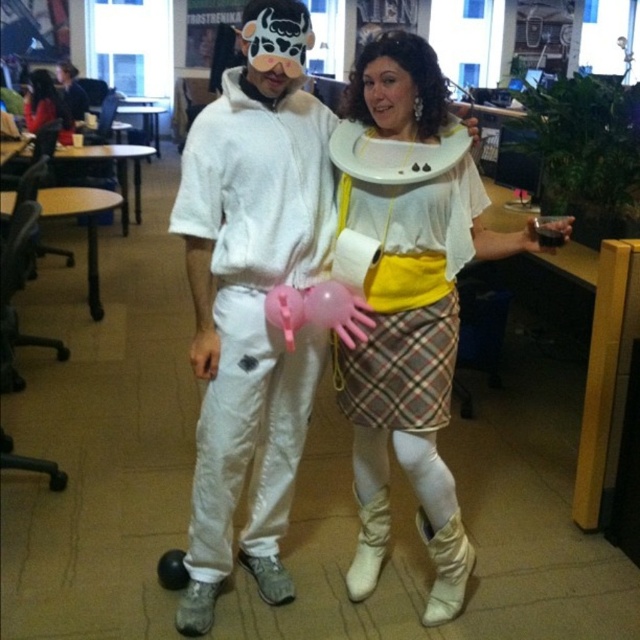
Looking at this image, you are standing in front of the office scene. There are two points marked in the image. The first point is at coordinate point (273, 563) and the second point is at coordinate point (180, 616). Which point is closer to you?

Point (273, 563) is closer to you because it is further to the viewer than point (180, 616).

Where is the yellow plaid skirt at center located in the image?

The yellow plaid skirt at center is located at point (x=406, y=296) in the image.

In the scene shown: You are an observer standing in front of the image. You notice the yellow plaid skirt at center and the pink rubber balloon at center. Which object is higher up in the image?

The yellow plaid skirt at center is taller than the pink rubber balloon at center, so the yellow plaid skirt at center is higher up in the image.